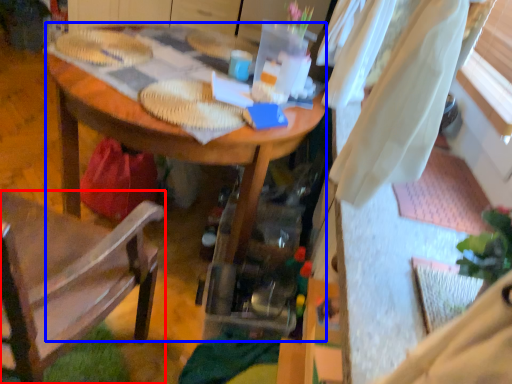
Question: Which object appears farthest to the camera in this image, chair (highlighted by a red box) or desk (highlighted by a blue box)?

Choices:
 (A) chair
 (B) desk

Answer: (B)